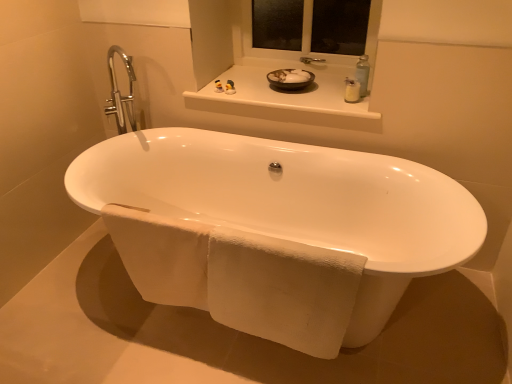
Locate an element on the screen. The height and width of the screenshot is (384, 512). free space underneath white glossy bowl at upper center (from a real-world perspective) is located at coordinates (288, 93).